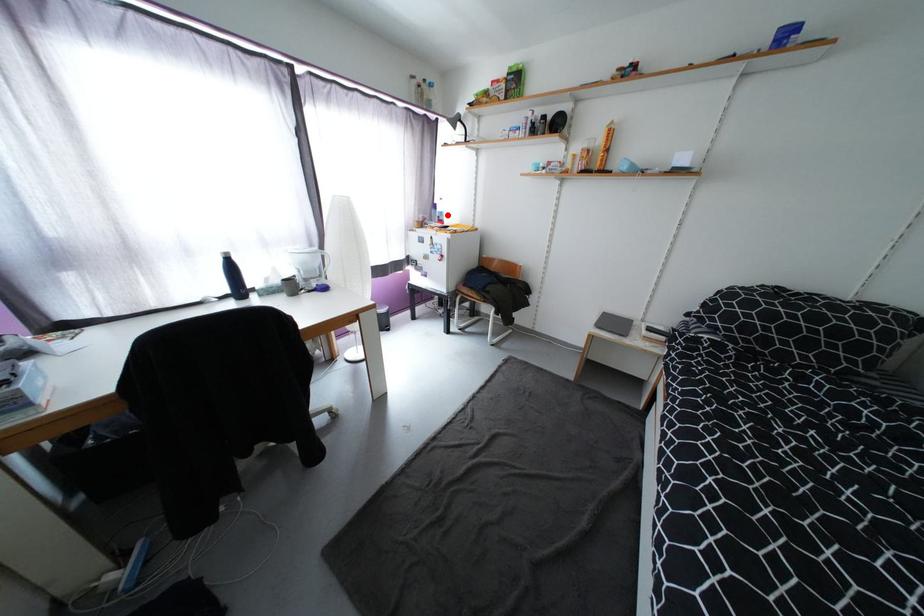
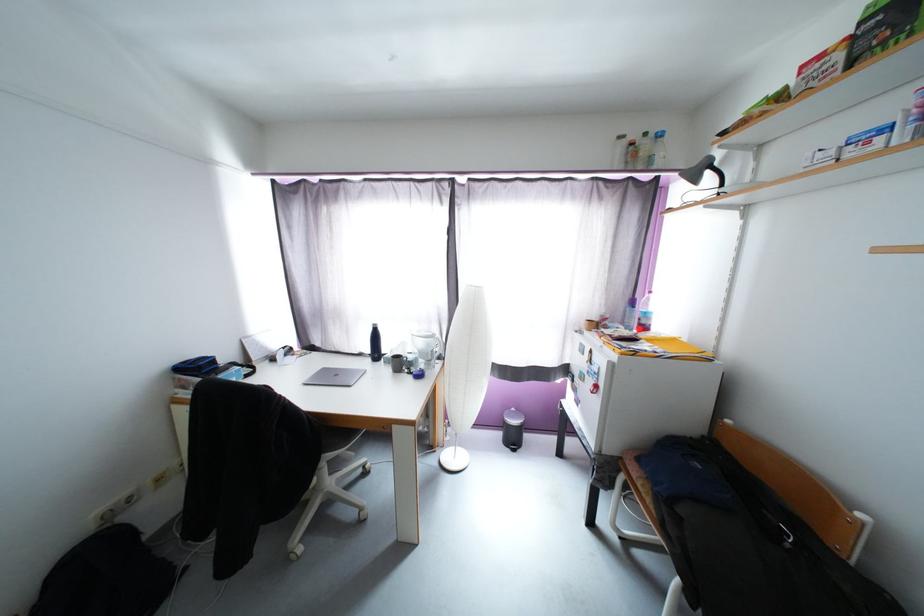
Question: I am providing you with two images of the same scene from different viewpoints. A red point is shown in image1. For the corresponding object point in image2, is it positioned nearer or farther from the camera?

Choices:
 (A) Nearer
 (B) Farther

Answer: (B)